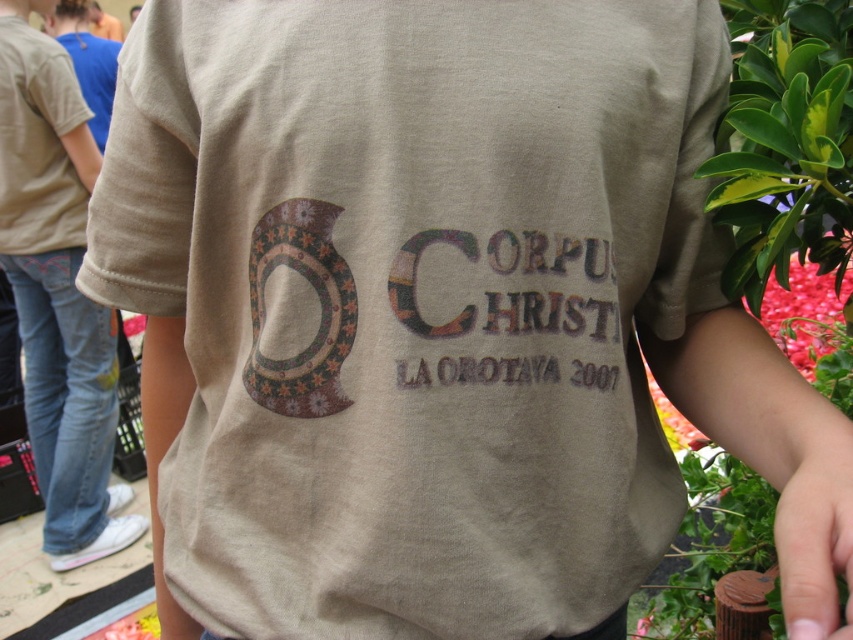
Question: Among these objects, which one is nearest to the camera?

Choices:
 (A) distressed brown text at center
 (B) light brown cotton shirt at center

Answer: (A)

Question: From the image, what is the correct spatial relationship of light brown cotton shirt at center in relation to distressed brown text at center?

Choices:
 (A) above
 (B) below

Answer: (A)

Question: Which of the following is the farthest from the observer?

Choices:
 (A) (402, 360)
 (B) (90, 486)

Answer: (B)

Question: Does light brown cotton shirt at center lie in front of distressed brown text at center?

Choices:
 (A) no
 (B) yes

Answer: (A)

Question: Can you confirm if light brown cotton shirt at center is positioned to the right of distressed brown text at center?

Choices:
 (A) yes
 (B) no

Answer: (B)